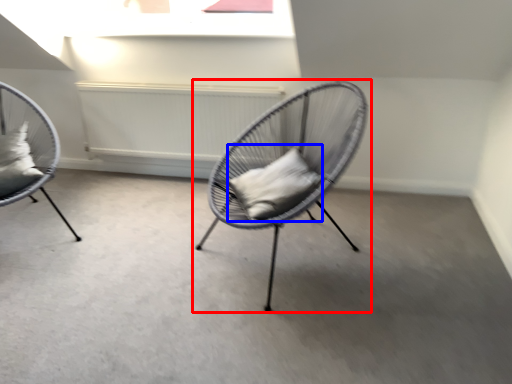
Question: Which object appears farthest to the camera in this image, chair (highlighted by a red box) or pillow (highlighted by a blue box)?

Choices:
 (A) chair
 (B) pillow

Answer: (B)